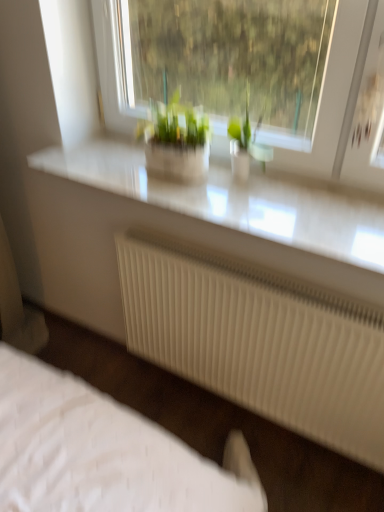
Question: Which direction should I rotate to face green matte plant at center, which is counted as the first houseplant, starting from the left, — up or down?

Choices:
 (A) down
 (B) up

Answer: (B)

Question: Is green glass vase at center, the 2th houseplant positioned from the left, next to white ribbed radiator at lower center and touching it?

Choices:
 (A) yes
 (B) no

Answer: (B)

Question: Is green glass vase at center, the 2th houseplant positioned from the left, not inside white ribbed radiator at lower center?

Choices:
 (A) no
 (B) yes

Answer: (B)

Question: Is green glass vase at center, the 2th houseplant positioned from the left, behind white ribbed radiator at lower center?

Choices:
 (A) no
 (B) yes

Answer: (B)

Question: From the image's perspective, is green glass vase at center, the 2th houseplant positioned from the left, located above white ribbed radiator at lower center?

Choices:
 (A) yes
 (B) no

Answer: (A)

Question: From the image's perspective, is green glass vase at center, the 2th houseplant positioned from the left, under white ribbed radiator at lower center?

Choices:
 (A) no
 (B) yes

Answer: (A)

Question: Is white ribbed radiator at lower center surrounded by green glass vase at center, which is the first houseplant in right-to-left order?

Choices:
 (A) yes
 (B) no

Answer: (B)

Question: Does white glossy counter top at upper center touch white ribbed radiator at lower center?

Choices:
 (A) no
 (B) yes

Answer: (A)

Question: Is white glossy counter top at upper center smaller than white ribbed radiator at lower center?

Choices:
 (A) no
 (B) yes

Answer: (B)

Question: Does white glossy counter top at upper center have a greater width compared to white ribbed radiator at lower center?

Choices:
 (A) no
 (B) yes

Answer: (B)

Question: From the image's perspective, is white glossy counter top at upper center beneath white ribbed radiator at lower center?

Choices:
 (A) yes
 (B) no

Answer: (B)

Question: Considering the relative positions of white glossy counter top at upper center and white ribbed radiator at lower center in the image provided, is white glossy counter top at upper center to the right of white ribbed radiator at lower center from the viewer's perspective?

Choices:
 (A) yes
 (B) no

Answer: (B)

Question: Would you say white glossy counter top at upper center contains white ribbed radiator at lower center?

Choices:
 (A) no
 (B) yes

Answer: (A)

Question: Does white ribbed radiator at lower center appear on the right side of green matte plant at center, the 2th houseplant from the right?

Choices:
 (A) yes
 (B) no

Answer: (A)